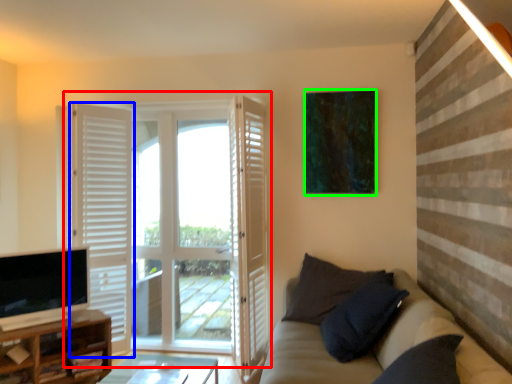
Question: Estimate the real-world distances between objects in this image. Which object is closer to door (highlighted by a red box), door (highlighted by a blue box) or picture frame (highlighted by a green box)?

Choices:
 (A) door
 (B) picture frame

Answer: (A)